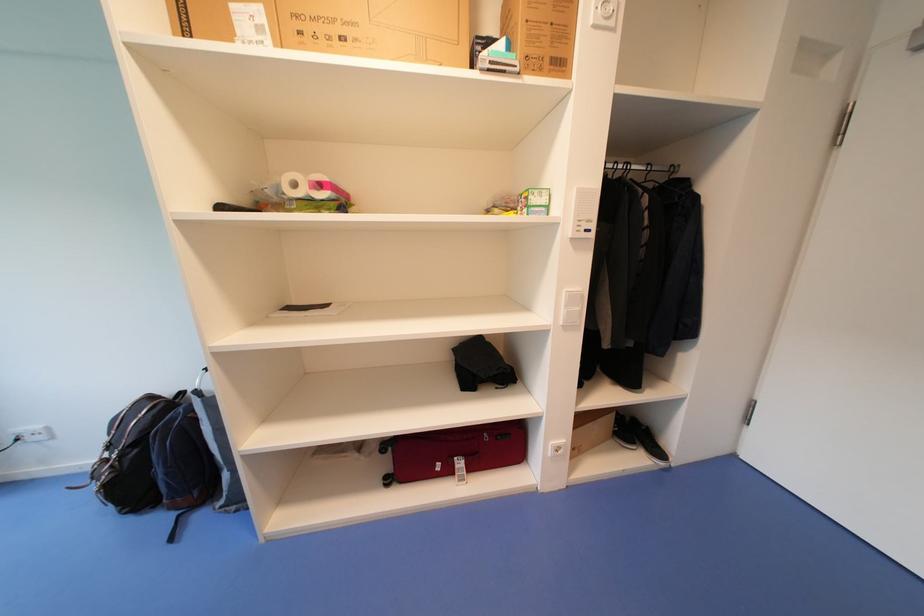
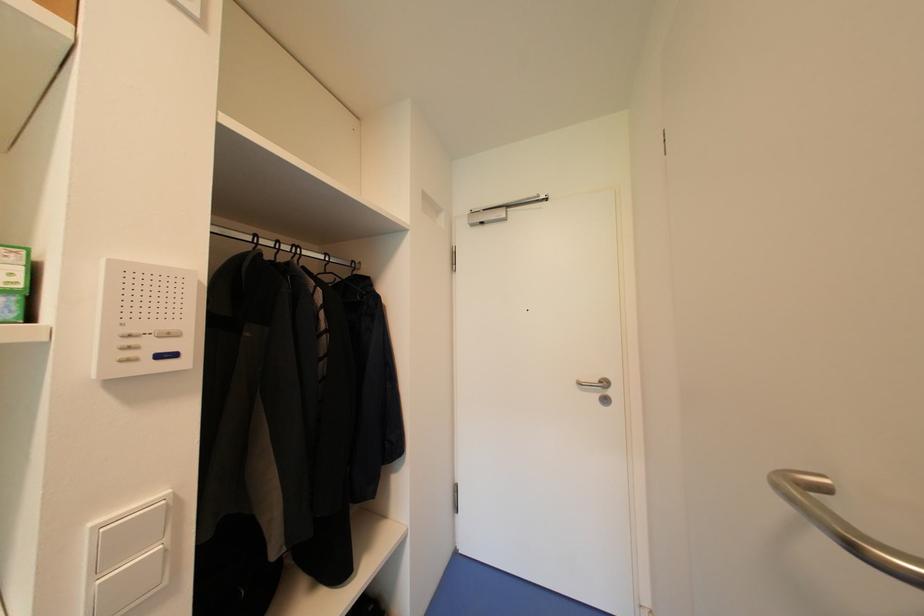
Question: The camera is either moving clockwise (left) or counter-clockwise (right) around the object. The first image is from the beginning of the video and the second image is from the end. Is the camera moving left or right when shooting the video?

Choices:
 (A) Left
 (B) Right

Answer: (A)